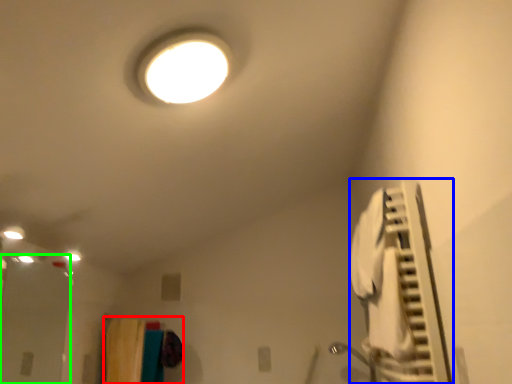
Question: Considering the real-world distances, which object is farthest from laundry (highlighted by a red box)? air conditioner (highlighted by a blue box) or glass door (highlighted by a green box)?

Choices:
 (A) air conditioner
 (B) glass door

Answer: (A)